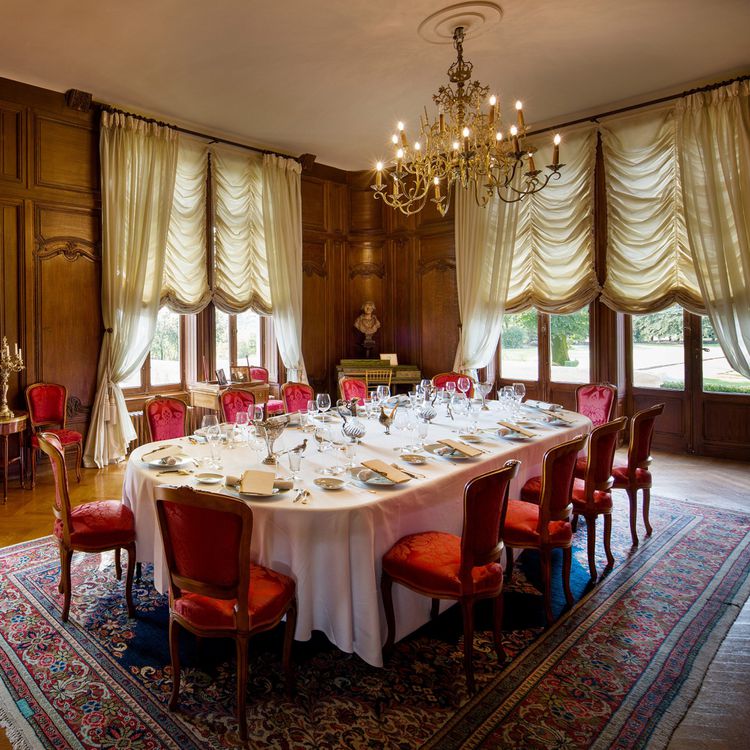
Locate an element on the screen. This screenshot has width=750, height=750. frame is located at coordinates (234, 506).